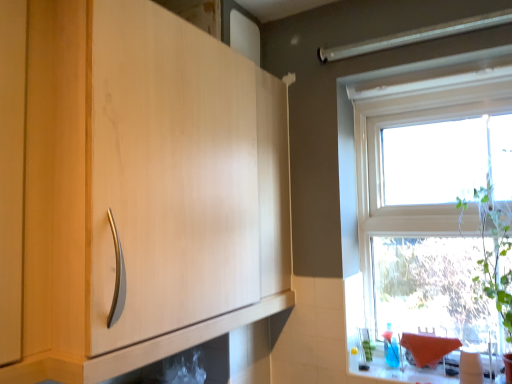
At what (x,y) coordinates should I click in order to perform the action: click on blank space situated above white glossy counter top at lower right (from a real-world perspective). Please return your answer as a coordinate pair (x, y). Image resolution: width=512 pixels, height=384 pixels. Looking at the image, I should click on (434, 372).